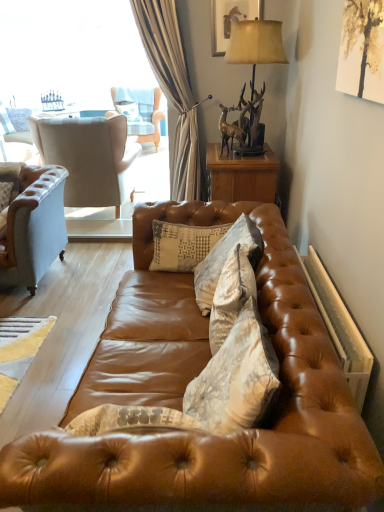
What do you see at coordinates (182, 245) in the screenshot? This screenshot has width=384, height=512. I see `patchwork fabric pillow at center, the second pillow when ordered from right to left` at bounding box center [182, 245].

This screenshot has height=512, width=384. Describe the element at coordinates (232, 127) in the screenshot. I see `metallic gold deer at upper right` at that location.

This screenshot has width=384, height=512. Describe the element at coordinates (232, 292) in the screenshot. I see `textured beige pillow at center, marked as the 3th pillow in a back-to-front arrangement` at that location.

The width and height of the screenshot is (384, 512). What do you see at coordinates (255, 44) in the screenshot?
I see `antlered bronze lamp at upper right` at bounding box center [255, 44].

Locate an element on the screen. light blue fabric chair at upper left, which ranks as the first chair in top-to-bottom order is located at coordinates (140, 112).

Does patchwork fabric pillow at center, the second pillow when ordered from right to left, have a greater width compared to white textured pillow at center, the 3th pillow from the front?

No, patchwork fabric pillow at center, the second pillow when ordered from right to left, is not wider than white textured pillow at center, the 3th pillow from the front.

From their relative heights in the image, would you say patchwork fabric pillow at center, the second pillow in the back-to-front sequence, is taller or shorter than white textured pillow at center, which ranks as the third pillow in right-to-left order?

Considering their sizes, patchwork fabric pillow at center, the second pillow in the back-to-front sequence, has less height than white textured pillow at center, which ranks as the third pillow in right-to-left order.

Would you say patchwork fabric pillow at center, the second pillow when ordered from right to left, is inside or outside white textured pillow at center, the 3th pillow from the front?

patchwork fabric pillow at center, the second pillow when ordered from right to left, exists outside the volume of white textured pillow at center, the 3th pillow from the front.

From the image's perspective, is textured beige pillow at center, marked as the 3th pillow in a back-to-front arrangement, positioned above or below shiny brown leather couch at center?

textured beige pillow at center, marked as the 3th pillow in a back-to-front arrangement, is situated higher than shiny brown leather couch at center in the image.

From their relative heights in the image, would you say textured beige pillow at center, marked as the 3th pillow in a back-to-front arrangement, is taller or shorter than shiny brown leather couch at center?

Considering their sizes, textured beige pillow at center, marked as the 3th pillow in a back-to-front arrangement, has less height than shiny brown leather couch at center.

At what (x,y) coordinates should I click in order to perform the action: click on the 1st pillow behind the shiny brown leather couch at center. Please return your answer as a coordinate pair (x, y). Looking at the image, I should click on (232, 292).

Is point (232, 252) farther from camera compared to point (11, 448)?

Yes, it is behind point (11, 448).

Is metallic gold deer at upper right smaller than wooden nightstand at center?

Yes.

Is metallic gold deer at upper right further to camera compared to wooden nightstand at center?

No, metallic gold deer at upper right is in front of wooden nightstand at center.

From the picture: Is wooden nightstand at center a part of metallic gold deer at upper right?

That's incorrect, wooden nightstand at center is not inside metallic gold deer at upper right.

Based on the photo, are metallic gold deer at upper right and wooden nightstand at center far apart?

metallic gold deer at upper right is actually quite close to wooden nightstand at center.

Can you confirm if light beige fabric wingback chair at left, which appears as the first chair when ordered from the bottom, is shorter than patchwork fabric pillow at center, the second pillow in the back-to-front sequence?

In fact, light beige fabric wingback chair at left, which appears as the first chair when ordered from the bottom, may be taller than patchwork fabric pillow at center, the second pillow in the back-to-front sequence.

Is patchwork fabric pillow at center, the 2th pillow when ordered from bottom to top, inside light beige fabric wingback chair at left, positioned as the second chair in back-to-front order?

No, patchwork fabric pillow at center, the 2th pillow when ordered from bottom to top, is located outside of light beige fabric wingback chair at left, positioned as the second chair in back-to-front order.

Does light beige fabric wingback chair at left, positioned as the second chair in back-to-front order, touch patchwork fabric pillow at center, the 2th pillow viewed from the top?

light beige fabric wingback chair at left, positioned as the second chair in back-to-front order, and patchwork fabric pillow at center, the 2th pillow viewed from the top, are not in contact.

From the image's perspective, which one is positioned higher, light beige fabric wingback chair at left, the first chair viewed from the front, or patchwork fabric pillow at center, the 2th pillow viewed from the left?

light beige fabric wingback chair at left, the first chair viewed from the front, is shown above in the image.

Considering the sizes of objects antlered bronze lamp at upper right and wooden nightstand at center in the image provided, who is taller, antlered bronze lamp at upper right or wooden nightstand at center?

antlered bronze lamp at upper right.

At what (x,y) coordinates should I click in order to perform the action: click on table lamp positioned vertically above the wooden nightstand at center (from a real-world perspective). Please return your answer as a coordinate pair (x, y). Looking at the image, I should click on (255, 44).

Is antlered bronze lamp at upper right to the left of wooden nightstand at center from the viewer's perspective?

In fact, antlered bronze lamp at upper right is to the right of wooden nightstand at center.

How much distance is there between antlered bronze lamp at upper right and wooden nightstand at center?

antlered bronze lamp at upper right is 65.31 centimeters from wooden nightstand at center.

Would you say wooden picture frame at upper center is outside white textured pillow at center, which ranks as the 1th pillow in left-to-right order?

Yes, wooden picture frame at upper center is outside of white textured pillow at center, which ranks as the 1th pillow in left-to-right order.

Would you say wooden picture frame at upper center is to the left or to the right of white textured pillow at center, the 3th pillow from the front, in the picture?

wooden picture frame at upper center is to the right of white textured pillow at center, the 3th pillow from the front.

Is wooden picture frame at upper center bigger or smaller than white textured pillow at center, positioned as the third pillow in bottom-to-top order?

Clearly, wooden picture frame at upper center is smaller in size than white textured pillow at center, positioned as the third pillow in bottom-to-top order.

In terms of height, does metallic gold deer at upper right look taller or shorter compared to textured beige pillow at center, positioned as the 3th pillow in top-to-bottom order?

Considering their sizes, metallic gold deer at upper right has less height than textured beige pillow at center, positioned as the 3th pillow in top-to-bottom order.

Would you say metallic gold deer at upper right is a long distance from textured beige pillow at center, which is counted as the 1th pillow, starting from the bottom?

Yes.

Consider the image. From the image's perspective, is metallic gold deer at upper right on top of textured beige pillow at center, placed as the 1th pillow when sorted from right to left?

Yes, from the image's perspective, metallic gold deer at upper right is above textured beige pillow at center, placed as the 1th pillow when sorted from right to left.

Which object is more forward, metallic gold deer at upper right or textured beige pillow at center, which is counted as the 1th pillow, starting from the bottom?

textured beige pillow at center, which is counted as the 1th pillow, starting from the bottom, is in front.

Image resolution: width=384 pixels, height=512 pixels. I want to click on pillow that is behind the patchwork fabric pillow at center, which is the 2th pillow from front to back, so click(x=129, y=110).

This screenshot has width=384, height=512. I want to click on studio couch on the left of the textured beige pillow at center, positioned as the 3th pillow in top-to-bottom order, so click(184, 390).

Based on their spatial positions, is light blue fabric chair at upper left, which ranks as the second chair in front-to-back order, or textured beige pillow at center, the first pillow from the front, further from light beige fabric wingback chair at left, the first chair viewed from the front?

Among the two, textured beige pillow at center, the first pillow from the front, is located further to light beige fabric wingback chair at left, the first chair viewed from the front.

Looking at the image, which one is located closer to white textured pillow at center, positioned as the third pillow in bottom-to-top order, light beige fabric wingback chair at left, the first chair viewed from the front, or light blue fabric chair at upper left, the 1th chair from the back?

Among the two, light blue fabric chair at upper left, the 1th chair from the back, is located nearer to white textured pillow at center, positioned as the third pillow in bottom-to-top order.

When comparing their distances from wooden picture frame at upper center, does metallic gold deer at upper right or wooden nightstand at center seem closer?

metallic gold deer at upper right.

Looking at the image, which one is located further to textured beige pillow at center, the first pillow from the front, wooden picture frame at upper center or patchwork fabric pillow at center, the 2th pillow viewed from the top?

wooden picture frame at upper center.

Looking at this image, considering their positions, is wooden nightstand at center positioned closer to patchwork fabric pillow at center, the second pillow when ordered from right to left, than wooden picture frame at upper center?

Based on the image, wooden nightstand at center appears to be nearer to patchwork fabric pillow at center, the second pillow when ordered from right to left.

Estimate the real-world distances between objects in this image. Which object is further from shiny brown leather couch at center, light blue fabric chair at upper left, which appears as the 2th chair when ordered from the bottom, or metallic gold deer at upper right?

light blue fabric chair at upper left, which appears as the 2th chair when ordered from the bottom.

When comparing their distances from metallic gold deer at upper right, does white textured pillow at center, the 1th pillow viewed from the back, or patchwork fabric pillow at center, the 2th pillow viewed from the top, seem closer?

The object closer to metallic gold deer at upper right is patchwork fabric pillow at center, the 2th pillow viewed from the top.

Based on their spatial positions, is antlered bronze lamp at upper right or patchwork fabric pillow at center, the 2th pillow when ordered from bottom to top, further from light blue fabric chair at upper left, which ranks as the first chair in top-to-bottom order?

patchwork fabric pillow at center, the 2th pillow when ordered from bottom to top, is further to light blue fabric chair at upper left, which ranks as the first chair in top-to-bottom order.

Where is `animal located between textured beige pillow at center, the first pillow from the front, and light blue fabric chair at upper left, which ranks as the first chair in top-to-bottom order, in the depth direction`? This screenshot has width=384, height=512. animal located between textured beige pillow at center, the first pillow from the front, and light blue fabric chair at upper left, which ranks as the first chair in top-to-bottom order, in the depth direction is located at coordinates (232, 127).

This screenshot has width=384, height=512. What are the coordinates of `nightstand positioned between patchwork fabric pillow at center, the second pillow in the back-to-front sequence, and white textured pillow at center, which is the 1th pillow from top to bottom, from near to far` in the screenshot? It's located at (242, 175).

Locate an element on the screen. The width and height of the screenshot is (384, 512). pillow between textured beige pillow at center, marked as the 3th pillow in a back-to-front arrangement, and light beige fabric wingback chair at left, which appears as the first chair when ordered from the bottom, from front to back is located at coordinates (182, 245).

Image resolution: width=384 pixels, height=512 pixels. Identify the location of nightstand between shiny brown leather couch at center and light blue fabric chair at upper left, which ranks as the second chair in front-to-back order, along the z-axis. click(242, 175).